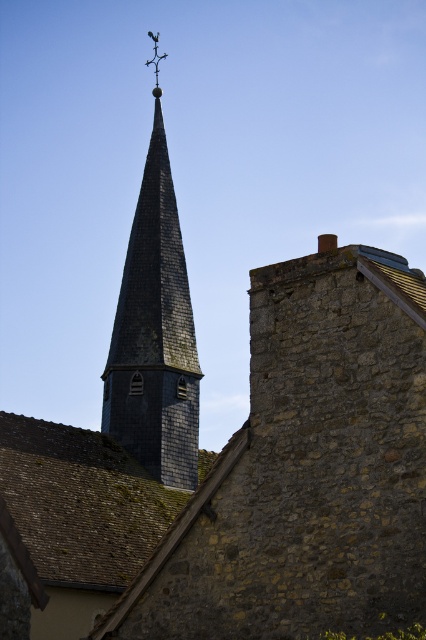
You are an architect analyzing the building structure. You see the shiny dark gray slate church tower at center and the metallic cross at upper center. Which object is positioned closer to the observer?

The shiny dark gray slate church tower at center is closer to the viewer than the metallic cross at upper center.

You are standing in front of the historic stone building and notice two points marked on the structure. The first point is at coordinate point (x=169, y=429) and the second is at point (x=155, y=90). Which of these two points is nearer to your current position?

Point (x=169, y=429) is closer to the viewer than point (x=155, y=90), so the first point is nearer to your current position.

You are a maintenance worker needing to inspect both the shiny dark gray slate church tower at center and the metallic cross at upper center. Given that your ladder can reach up to 15 meters, can you safely inspect both objects from the ground without moving the ladder?

The distance between the shiny dark gray slate church tower at center and the metallic cross at upper center is 17.54 meters. Since your ladder only reaches up to 15 meters, you cannot safely inspect both objects from the ground without moving the ladder.